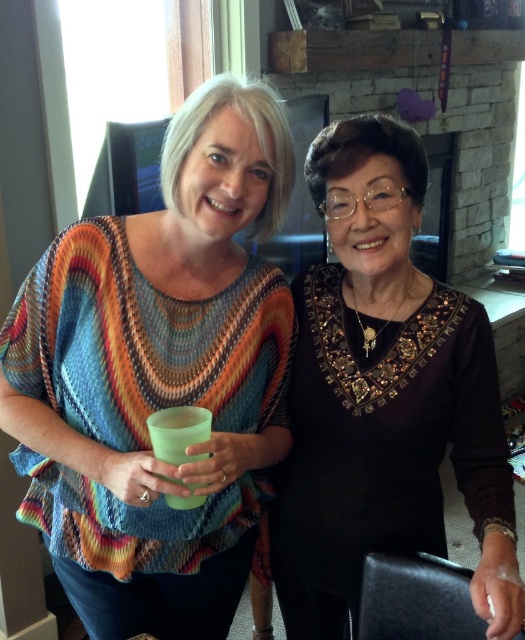
Question: Which object appears farthest from the camera in this image?

Choices:
 (A) black sequined blouse at center
 (B) matte green glass at center

Answer: (B)

Question: Which of the following is the farthest from the observer?

Choices:
 (A) (226, 198)
 (B) (447, 312)

Answer: (B)

Question: Can you confirm if matte green glass at center is bigger than black sequined blouse at center?

Choices:
 (A) no
 (B) yes

Answer: (A)

Question: Which object is farther from the camera taking this photo?

Choices:
 (A) matte green glass at center
 (B) black sequined blouse at center

Answer: (A)

Question: Does matte green glass at center appear under black sequined blouse at center?

Choices:
 (A) yes
 (B) no

Answer: (B)

Question: Is matte green glass at center smaller than black sequined blouse at center?

Choices:
 (A) yes
 (B) no

Answer: (A)